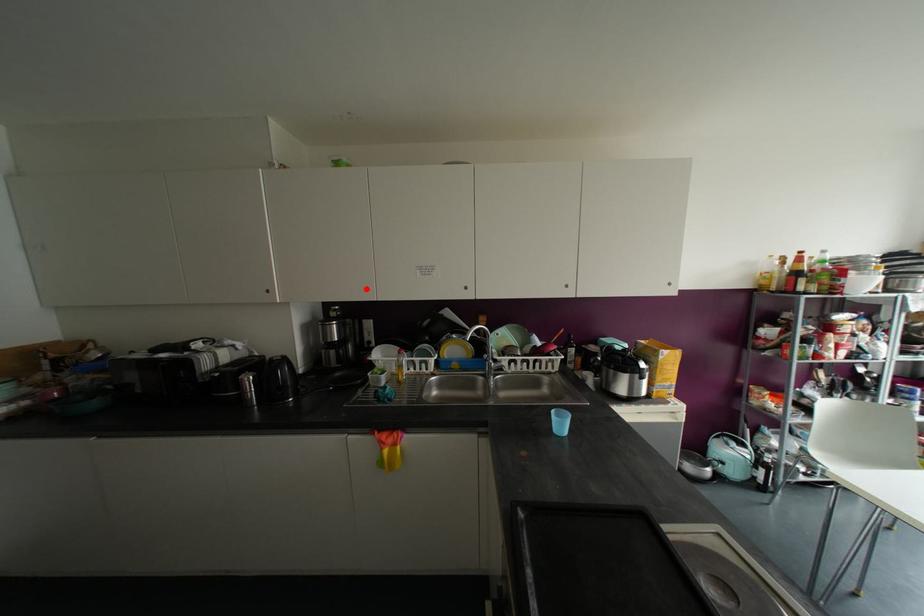
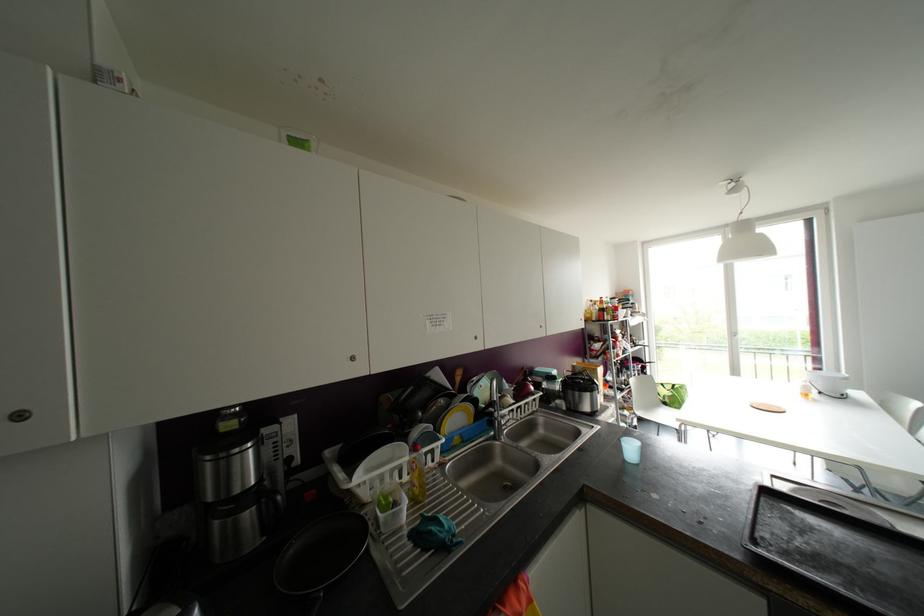
Find the pixel in the second image that matches the highlighted location in the first image.

(351, 358)